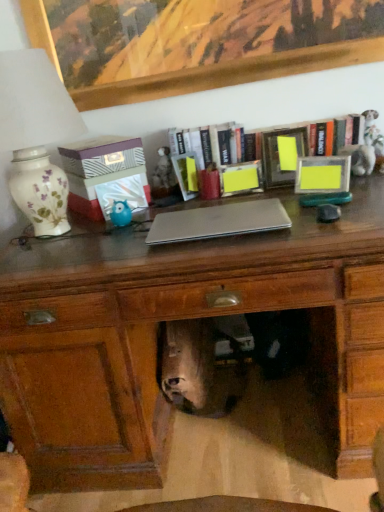
At what (x,y) coordinates should I click in order to perform the action: click on vacant space underneath white floral ceramic lamp at left (from a real-world perspective). Please return your answer as a coordinate pair (x, y). Looking at the image, I should click on (44, 239).